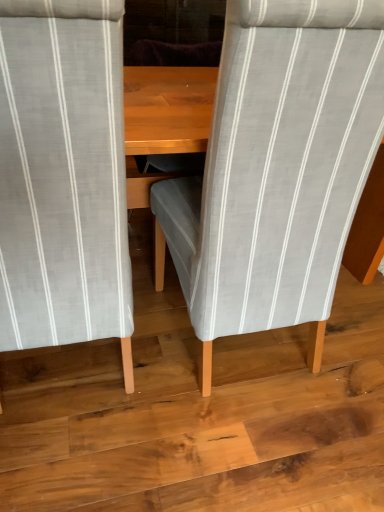
Question: Is wooden floor at center to the right of light gray striped fabric chair at center, placed as the 2th chair when sorted from left to right, from the viewer's perspective?

Choices:
 (A) yes
 (B) no

Answer: (A)

Question: From a real-world perspective, does wooden floor at center sit lower than light gray striped fabric chair at center, the first chair positioned from the right?

Choices:
 (A) no
 (B) yes

Answer: (B)

Question: Can you confirm if wooden floor at center is taller than light gray striped fabric chair at center, the first chair positioned from the right?

Choices:
 (A) yes
 (B) no

Answer: (B)

Question: Can you confirm if wooden floor at center is bigger than light gray striped fabric chair at center, placed as the 2th chair when sorted from left to right?

Choices:
 (A) yes
 (B) no

Answer: (B)

Question: Is wooden floor at center beside light gray striped fabric chair at center, the first chair positioned from the right?

Choices:
 (A) no
 (B) yes

Answer: (A)

Question: Relative to light gray striped fabric chair at center, placed as the 2th chair when sorted from left to right, is light gray striped fabric chair at center, which is the first chair in left-to-right order, in front or behind?

Choices:
 (A) behind
 (B) front

Answer: (B)

Question: Considering the positions of light gray striped fabric chair at center, the second chair when ordered from right to left, and light gray striped fabric chair at center, the first chair positioned from the right, in the image, is light gray striped fabric chair at center, the second chair when ordered from right to left, wider or thinner than light gray striped fabric chair at center, the first chair positioned from the right,?

Choices:
 (A) wide
 (B) thin

Answer: (B)

Question: Is light gray striped fabric chair at center, which is the first chair in left-to-right order, situated inside light gray striped fabric chair at center, the first chair positioned from the right, or outside?

Choices:
 (A) inside
 (B) outside

Answer: (B)

Question: From their relative heights in the image, would you say light gray striped fabric chair at center, which is the first chair in left-to-right order, is taller or shorter than light gray striped fabric chair at center, the first chair positioned from the right?

Choices:
 (A) short
 (B) tall

Answer: (A)

Question: Is point (64, 266) closer or farther from the camera than point (337, 373)?

Choices:
 (A) farther
 (B) closer

Answer: (B)

Question: In terms of width, does light gray striped fabric chair at center, the second chair when ordered from right to left, look wider or thinner when compared to wooden floor at center?

Choices:
 (A) thin
 (B) wide

Answer: (A)

Question: Is light gray striped fabric chair at center, the second chair when ordered from right to left, to the left or to the right of wooden floor at center in the image?

Choices:
 (A) right
 (B) left

Answer: (B)

Question: Do you think light gray striped fabric chair at center, the second chair when ordered from right to left, is within wooden floor at center, or outside of it?

Choices:
 (A) outside
 (B) inside

Answer: (A)

Question: From their relative heights in the image, would you say light gray striped fabric chair at center, placed as the 2th chair when sorted from left to right, is taller or shorter than wooden floor at center?

Choices:
 (A) short
 (B) tall

Answer: (B)

Question: Is light gray striped fabric chair at center, placed as the 2th chair when sorted from left to right, inside or outside of wooden floor at center?

Choices:
 (A) inside
 (B) outside

Answer: (B)